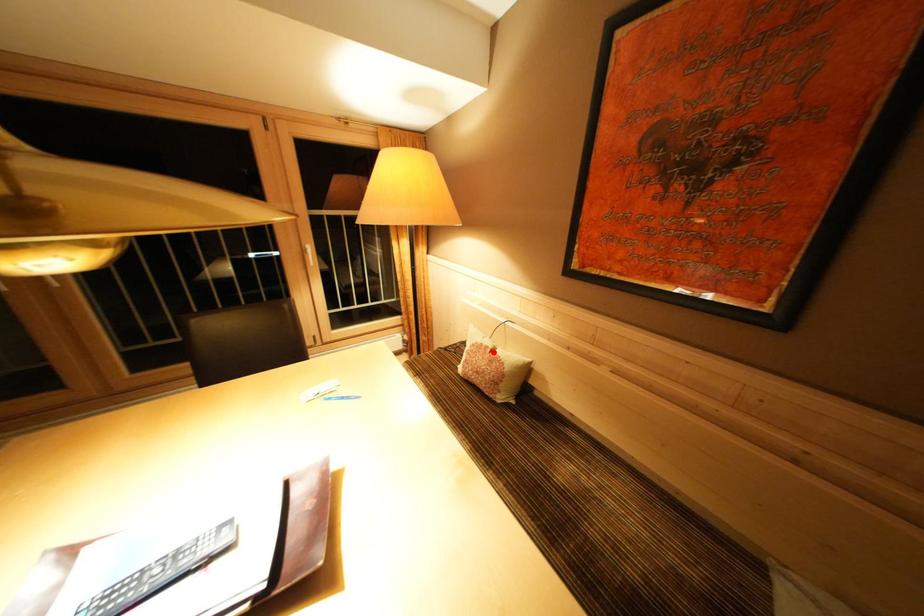
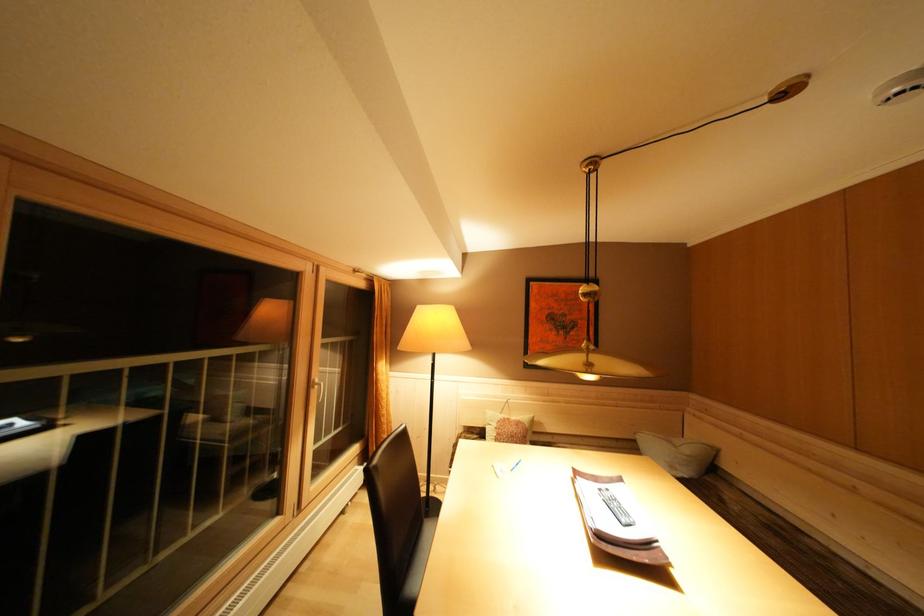
Question: A red point is marked in image1. In image2, is the corresponding 3D point closer to the camera or farther? Reply with the corresponding letter.

Choices:
 (A) The corresponding 3D point is closer.
 (B) The corresponding 3D point is farther.

Answer: (B)